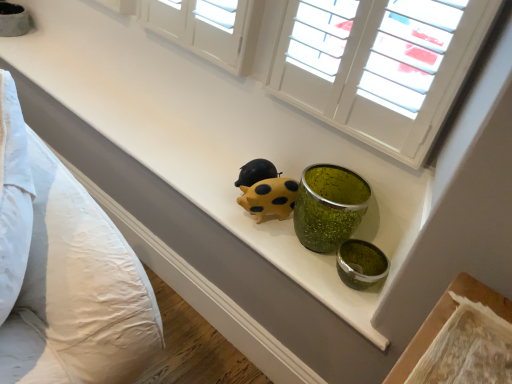
Where is `yellow matte rubber ladybug at center`? This screenshot has height=384, width=512. yellow matte rubber ladybug at center is located at coordinates (269, 198).

Based on the photo, measure the distance between point (x=443, y=98) and camera.

They are 1.05 meters apart.

Where is `yellow matte rubber ladybug at center`? This screenshot has width=512, height=384. yellow matte rubber ladybug at center is located at coordinates (269, 198).

Is white cotton pillows at left completely or partially inside yellow matte rubber ladybug at center?

Definitely not — white cotton pillows at left is not inside yellow matte rubber ladybug at center.

Are yellow matte rubber ladybug at center and white cotton pillows at left beside each other?

yellow matte rubber ladybug at center and white cotton pillows at left are not in contact.

The width and height of the screenshot is (512, 384). Find the location of `ladybug below the white cotton pillows at left (from a real-world perspective)`. ladybug below the white cotton pillows at left (from a real-world perspective) is located at coordinates (269, 198).

Considering the relative sizes of yellow matte rubber ladybug at center and white cotton pillows at left in the image provided, is yellow matte rubber ladybug at center bigger than white cotton pillows at left?

No, yellow matte rubber ladybug at center is not bigger than white cotton pillows at left.

The image size is (512, 384). Identify the location of window above the white cotton pillows at left (from a real-world perspective). (378, 66).

Is white cotton pillows at left not close to white textured shutters at upper center?

No, white cotton pillows at left is in close proximity to white textured shutters at upper center.

Does white cotton pillows at left have a larger size compared to white textured shutters at upper center?

Yes.

Considering the relative sizes of white cotton pillows at left and white textured shutters at upper center in the image provided, is white cotton pillows at left wider than white textured shutters at upper center?

Yes, white cotton pillows at left is wider than white textured shutters at upper center.

Which of these two, white textured shutters at upper center or white cotton pillows at left, is wider?

white cotton pillows at left.

Who is taller, white textured shutters at upper center or white cotton pillows at left?

With more height is white cotton pillows at left.

Identify the location of window above the white cotton pillows at left (from a real-world perspective). This screenshot has height=384, width=512. [x=378, y=66].

From the image's perspective, is white textured shutters at upper center located above white cotton pillows at left?

Yes.

Which of these two, white cotton pillows at left or yellow matte rubber ladybug at center, is bigger?

white cotton pillows at left.

Where is `bedding that is in front of the yellow matte rubber ladybug at center`? Image resolution: width=512 pixels, height=384 pixels. bedding that is in front of the yellow matte rubber ladybug at center is located at coordinates (64, 272).

Is white cotton pillows at left beside yellow matte rubber ladybug at center?

No, white cotton pillows at left is not in contact with yellow matte rubber ladybug at center.

How many degrees apart are the facing directions of yellow matte rubber ladybug at center and white textured shutters at upper center?

The angle between the facing direction of yellow matte rubber ladybug at center and the facing direction of white textured shutters at upper center is 33.7 degrees.

Is yellow matte rubber ladybug at center not close to white textured shutters at upper center?

No, yellow matte rubber ladybug at center is not far from white textured shutters at upper center.

Is yellow matte rubber ladybug at center at the left side of white textured shutters at upper center?

Yes, yellow matte rubber ladybug at center is to the left of white textured shutters at upper center.

From a real-world perspective, which is physically below, yellow matte rubber ladybug at center or white textured shutters at upper center?

yellow matte rubber ladybug at center.

Based on the photo, considering the relative sizes of white textured shutters at upper center and yellow matte rubber ladybug at center in the image provided, is white textured shutters at upper center bigger than yellow matte rubber ladybug at center?

Correct, white textured shutters at upper center is larger in size than yellow matte rubber ladybug at center.

Is white textured shutters at upper center thinner than yellow matte rubber ladybug at center?

Indeed, white textured shutters at upper center has a lesser width compared to yellow matte rubber ladybug at center.

Which of these two, white textured shutters at upper center or yellow matte rubber ladybug at center, stands taller?

Standing taller between the two is white textured shutters at upper center.

From a real-world perspective, is white textured shutters at upper center located higher than yellow matte rubber ladybug at center?

Correct, in the physical world, white textured shutters at upper center is higher than yellow matte rubber ladybug at center.

The image size is (512, 384). Identify the location of bedding located above the yellow matte rubber ladybug at center (from a real-world perspective). (64, 272).

The width and height of the screenshot is (512, 384). What are the coordinates of `bedding in front of the white textured shutters at upper center` in the screenshot? It's located at (64, 272).

Considering their positions, is yellow matte rubber ladybug at center positioned further to white textured shutters at upper center than white cotton pillows at left?

The object further to white textured shutters at upper center is white cotton pillows at left.

Considering their positions, is white textured shutters at upper center positioned further to yellow matte rubber ladybug at center than white cotton pillows at left?

white cotton pillows at left.

From the image, which object appears to be farther from white cotton pillows at left, yellow matte rubber ladybug at center or white textured shutters at upper center?

Based on the image, white textured shutters at upper center appears to be further to white cotton pillows at left.

Estimate the real-world distances between objects in this image. Which object is further from white textured shutters at upper center, white cotton pillows at left or yellow matte rubber ladybug at center?

Based on the image, white cotton pillows at left appears to be further to white textured shutters at upper center.

Considering their positions, is white textured shutters at upper center positioned further to white cotton pillows at left than yellow matte rubber ladybug at center?

white textured shutters at upper center.

Which object lies nearer to the anchor point yellow matte rubber ladybug at center, white cotton pillows at left or white textured shutters at upper center?

Based on the image, white textured shutters at upper center appears to be nearer to yellow matte rubber ladybug at center.

The image size is (512, 384). In order to click on window located between white cotton pillows at left and yellow matte rubber ladybug at center in the depth direction in this screenshot , I will do (x=378, y=66).